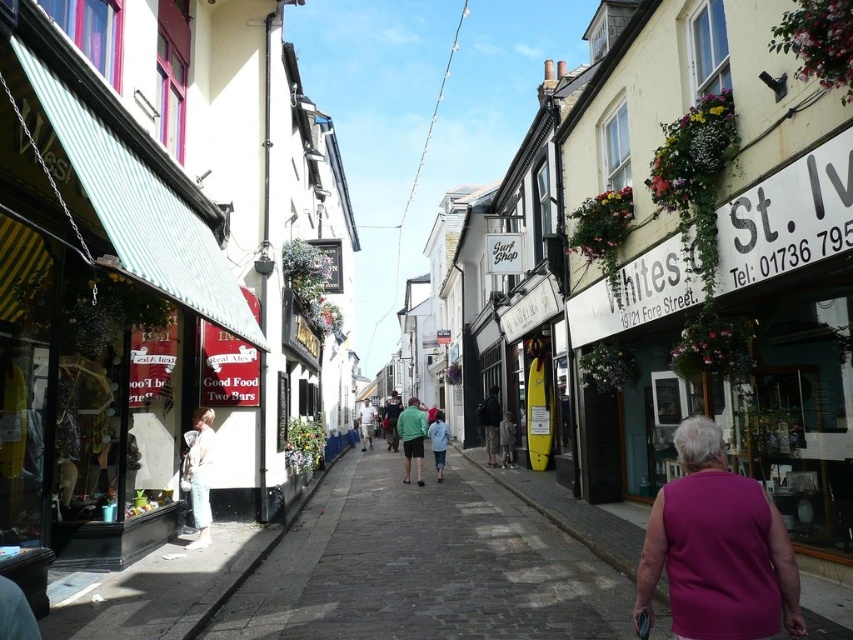
Does point (396, 419) come closer to viewer compared to point (509, 456)?

No, it is not.

Does point (409, 428) come in front of point (500, 451)?

Yes, it is.

This screenshot has height=640, width=853. Identify the location of green cotton shirt at center. (410, 436).

Can you confirm if light blue denim jacket at center is smaller than light brown leather jacket at center?

Actually, light blue denim jacket at center might be larger than light brown leather jacket at center.

Is light blue denim jacket at center wider than light brown leather jacket at center?

Indeed, light blue denim jacket at center has a greater width compared to light brown leather jacket at center.

Is point (432, 422) less distant than point (508, 452)?

Yes, point (432, 422) is closer to viewer.

Image resolution: width=853 pixels, height=640 pixels. I want to click on light blue denim jacket at center, so click(438, 442).

Does purple sleeveless top at lower right have a lesser width compared to green matte jacket at center?

Correct, purple sleeveless top at lower right's width is less than green matte jacket at center's.

Is purple sleeveless top at lower right below green matte jacket at center?

Actually, purple sleeveless top at lower right is above green matte jacket at center.

Is point (672, 484) positioned in front of point (412, 448)?

That is True.

Identify the location of purple sleeveless top at lower right. pyautogui.click(x=717, y=548).